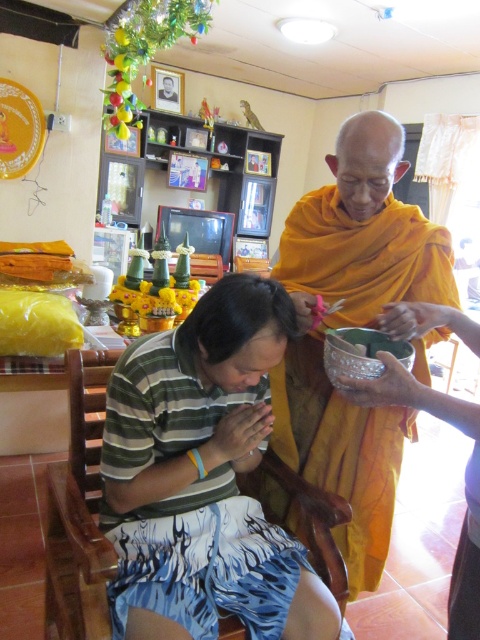
Question: Can you confirm if orange cloth at upper right is bigger than wooden chair at lower center?

Choices:
 (A) no
 (B) yes

Answer: (B)

Question: Among these points, which one is nearest to the camera?

Choices:
 (A) (280, 280)
 (B) (279, 307)

Answer: (B)

Question: Estimate the real-world distances between objects in this image. Which object is closer to the wooden chair at lower center?

Choices:
 (A) black matte hair at center
 (B) orange cloth at upper right

Answer: (A)

Question: Does orange cloth at upper right come in front of wooden chair at lower center?

Choices:
 (A) no
 (B) yes

Answer: (A)

Question: Considering the relative positions of orange cloth at upper right and black matte hair at center in the image provided, where is orange cloth at upper right located with respect to black matte hair at center?

Choices:
 (A) left
 (B) right

Answer: (B)

Question: Estimate the real-world distances between objects in this image. Which object is closer to the wooden chair at lower center?

Choices:
 (A) black matte hair at center
 (B) orange cloth at upper right

Answer: (A)